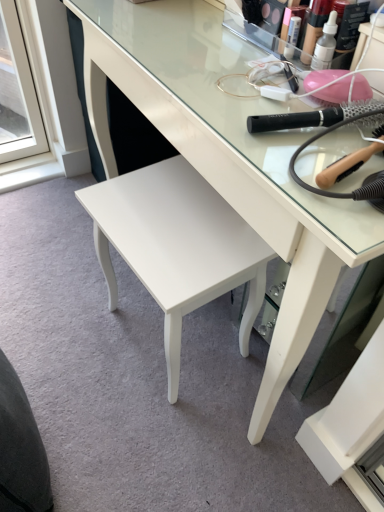
What do you see at coordinates (177, 246) in the screenshot? This screenshot has width=384, height=512. I see `white glossy stool at center` at bounding box center [177, 246].

Locate an element on the screen. translucent plastic makeup at upper center is located at coordinates (347, 32).

What is the approximate width of black plastic hairbrush at upper right, which is counted as the first brush, starting from the top?

The width of black plastic hairbrush at upper right, which is counted as the first brush, starting from the top, is 10.03 inches.

Where is `dark gray fabric swivel chair at lower left`? This screenshot has height=512, width=384. dark gray fabric swivel chair at lower left is located at coordinates (20, 449).

Describe the element at coordinates (227, 155) in the screenshot. The image size is (384, 512). I see `white glossy desk at center` at that location.

This screenshot has height=512, width=384. Describe the element at coordinates (350, 162) in the screenshot. I see `wooden-handled hairbrush at upper right, acting as the 1th brush starting from the bottom` at that location.

Where is `white glossy stool at center`? white glossy stool at center is located at coordinates (177, 246).

Considering the sizes of objects white glossy desk at center and black plastic hairbrush at upper right, the second brush when ordered from bottom to top, in the image provided, who is smaller, white glossy desk at center or black plastic hairbrush at upper right, the second brush when ordered from bottom to top,?

With smaller size is black plastic hairbrush at upper right, the second brush when ordered from bottom to top.

Who is shorter, white glossy desk at center or black plastic hairbrush at upper right, which is counted as the first brush, starting from the top?

black plastic hairbrush at upper right, which is counted as the first brush, starting from the top, is shorter.

Locate an element on the screen. desk located on the left of black plastic hairbrush at upper right, which is counted as the first brush, starting from the top is located at coordinates (227, 155).

Is white glossy desk at center not close to black plastic hairbrush at upper right, the second brush when ordered from bottom to top?

Actually, white glossy desk at center and black plastic hairbrush at upper right, the second brush when ordered from bottom to top, are a little close together.

Is translucent plastic makeup at upper center placed right next to black plastic hairbrush at upper right, which is counted as the first brush, starting from the top?

No, translucent plastic makeup at upper center is not making contact with black plastic hairbrush at upper right, which is counted as the first brush, starting from the top.

In the scene shown: In terms of height, does translucent plastic makeup at upper center look taller or shorter compared to black plastic hairbrush at upper right, which is counted as the first brush, starting from the top?

Clearly, translucent plastic makeup at upper center is taller compared to black plastic hairbrush at upper right, which is counted as the first brush, starting from the top.

Can you confirm if translucent plastic makeup at upper center is positioned to the right of black plastic hairbrush at upper right, the second brush when ordered from bottom to top?

No, translucent plastic makeup at upper center is not to the right of black plastic hairbrush at upper right, the second brush when ordered from bottom to top.

In the scene shown: Can you tell me how much translucent plastic makeup at upper center and black plastic hairbrush at upper right, the second brush when ordered from bottom to top, differ in facing direction?

22 degrees.

Can you confirm if black plastic hairbrush at upper right, the second brush when ordered from bottom to top, is smaller than translucent plastic makeup at upper center?

Yes.

Which object is wider, black plastic hairbrush at upper right, which is counted as the first brush, starting from the top, or translucent plastic makeup at upper center?

With larger width is black plastic hairbrush at upper right, which is counted as the first brush, starting from the top.

Would you consider black plastic hairbrush at upper right, which is counted as the first brush, starting from the top, to be distant from translucent plastic makeup at upper center?

No, black plastic hairbrush at upper right, which is counted as the first brush, starting from the top, is not far from translucent plastic makeup at upper center.

Considering the positions of objects black plastic hairbrush at upper right, which is counted as the first brush, starting from the top, and translucent plastic makeup at upper center in the image provided, who is more to the left, black plastic hairbrush at upper right, which is counted as the first brush, starting from the top, or translucent plastic makeup at upper center?

translucent plastic makeup at upper center.

Can you confirm if black plastic hairbrush at upper right, the second brush when ordered from bottom to top, is positioned to the right of white glossy desk at center?

Indeed, black plastic hairbrush at upper right, the second brush when ordered from bottom to top, is positioned on the right side of white glossy desk at center.

Is black plastic hairbrush at upper right, which is counted as the first brush, starting from the top, next to white glossy desk at center and touching it?

No, black plastic hairbrush at upper right, which is counted as the first brush, starting from the top, is not touching white glossy desk at center.

Is black plastic hairbrush at upper right, the second brush when ordered from bottom to top, thinner than white glossy desk at center?

Correct, the width of black plastic hairbrush at upper right, the second brush when ordered from bottom to top, is less than that of white glossy desk at center.

From the image's perspective, is black plastic hairbrush at upper right, the second brush when ordered from bottom to top, located above or below white glossy desk at center?

black plastic hairbrush at upper right, the second brush when ordered from bottom to top, is above white glossy desk at center.

Which of these two, dark gray fabric swivel chair at lower left or white glossy stool at center, is wider?

white glossy stool at center is wider.

Is dark gray fabric swivel chair at lower left looking in the opposite direction of white glossy stool at center?

Yes, dark gray fabric swivel chair at lower left's orientation is away from white glossy stool at center.

Between dark gray fabric swivel chair at lower left and white glossy stool at center, which one appears on the right side from the viewer's perspective?

From the viewer's perspective, white glossy stool at center appears more on the right side.

Is dark gray fabric swivel chair at lower left not near white glossy stool at center?

They are positioned close to each other.

You are a GUI agent. You are given a task and a screenshot of the screen. Output one action in this format:
    pyautogui.click(x=<x>, y=<y>)
    Task: Click on the 2nd brush positioned above the white glossy stool at center (from a real-world perspective)
    Image resolution: width=384 pixels, height=512 pixels.
    Given the screenshot: What is the action you would take?
    pyautogui.click(x=350, y=162)

Does wooden-handled hairbrush at upper right, acting as the 1th brush starting from the bottom, have a smaller size compared to white glossy stool at center?

Yes, wooden-handled hairbrush at upper right, acting as the 1th brush starting from the bottom, is smaller than white glossy stool at center.

From the image's perspective, who appears lower, wooden-handled hairbrush at upper right, marked as the 2th brush in a top-to-bottom arrangement, or white glossy stool at center?

white glossy stool at center.

How different are the orientations of wooden-handled hairbrush at upper right, marked as the 2th brush in a top-to-bottom arrangement, and white glossy stool at center in degrees?

The facing directions of wooden-handled hairbrush at upper right, marked as the 2th brush in a top-to-bottom arrangement, and white glossy stool at center are 175 degrees apart.

Does black plastic hairbrush at upper right, the second brush when ordered from bottom to top, have a larger size compared to white glossy stool at center?

Actually, black plastic hairbrush at upper right, the second brush when ordered from bottom to top, might be smaller than white glossy stool at center.

From the picture: Is the position of black plastic hairbrush at upper right, which is counted as the first brush, starting from the top, more distant than that of white glossy stool at center?

No, it is in front of white glossy stool at center.

Based on their positions, is black plastic hairbrush at upper right, which is counted as the first brush, starting from the top, located to the left or right of white glossy stool at center?

In the image, black plastic hairbrush at upper right, which is counted as the first brush, starting from the top, appears on the right side of white glossy stool at center.

The height and width of the screenshot is (512, 384). What are the coordinates of `brush that is the 2nd one when counting backward from the white glossy desk at center` in the screenshot? It's located at (311, 117).

Where is `toiletry on the left of black plastic hairbrush at upper right, which is counted as the first brush, starting from the top`? The height and width of the screenshot is (512, 384). toiletry on the left of black plastic hairbrush at upper right, which is counted as the first brush, starting from the top is located at coordinates tap(347, 32).

Considering their positions, is dark gray fabric swivel chair at lower left positioned further to white glossy desk at center than white glossy stool at center?

Based on the image, dark gray fabric swivel chair at lower left appears to be further to white glossy desk at center.

Considering their positions, is translucent plastic makeup at upper center positioned closer to white glossy stool at center than white glossy desk at center?

white glossy desk at center is closer to white glossy stool at center.

Considering their positions, is black plastic hairbrush at upper right, the second brush when ordered from bottom to top, positioned further to translucent plastic makeup at upper center than white glossy stool at center?

Among the two, white glossy stool at center is located further to translucent plastic makeup at upper center.

When comparing their distances from translucent plastic makeup at upper center, does wooden-handled hairbrush at upper right, marked as the 2th brush in a top-to-bottom arrangement, or white glossy stool at center seem further?

white glossy stool at center is further to translucent plastic makeup at upper center.

From the image, which object appears to be farther from wooden-handled hairbrush at upper right, acting as the 1th brush starting from the bottom, white glossy stool at center or black plastic hairbrush at upper right, the second brush when ordered from bottom to top?

white glossy stool at center is positioned further to the anchor wooden-handled hairbrush at upper right, acting as the 1th brush starting from the bottom.

Based on the photo, based on their spatial positions, is black plastic hairbrush at upper right, which is counted as the first brush, starting from the top, or white glossy desk at center closer to wooden-handled hairbrush at upper right, marked as the 2th brush in a top-to-bottom arrangement?

black plastic hairbrush at upper right, which is counted as the first brush, starting from the top, is positioned closer to the anchor wooden-handled hairbrush at upper right, marked as the 2th brush in a top-to-bottom arrangement.

Looking at the image, which one is located further to white glossy stool at center, white glossy desk at center or wooden-handled hairbrush at upper right, marked as the 2th brush in a top-to-bottom arrangement?

Among the two, wooden-handled hairbrush at upper right, marked as the 2th brush in a top-to-bottom arrangement, is located further to white glossy stool at center.

From the image, which object appears to be farther from white glossy stool at center, black plastic hairbrush at upper right, the second brush when ordered from bottom to top, or wooden-handled hairbrush at upper right, acting as the 1th brush starting from the bottom?

wooden-handled hairbrush at upper right, acting as the 1th brush starting from the bottom.

Find the location of a particular element. The width and height of the screenshot is (384, 512). desk located between dark gray fabric swivel chair at lower left and black plastic hairbrush at upper right, the second brush when ordered from bottom to top, in the left-right direction is located at coordinates (227, 155).

This screenshot has height=512, width=384. I want to click on brush between translucent plastic makeup at upper center and wooden-handled hairbrush at upper right, acting as the 1th brush starting from the bottom, vertically, so click(x=311, y=117).

Image resolution: width=384 pixels, height=512 pixels. What are the coordinates of `stool between translucent plastic makeup at upper center and dark gray fabric swivel chair at lower left in the vertical direction` in the screenshot? It's located at (177, 246).

At what (x,y) coordinates should I click in order to perform the action: click on brush between white glossy stool at center and wooden-handled hairbrush at upper right, acting as the 1th brush starting from the bottom, in the horizontal direction. Please return your answer as a coordinate pair (x, y). Looking at the image, I should click on (311, 117).